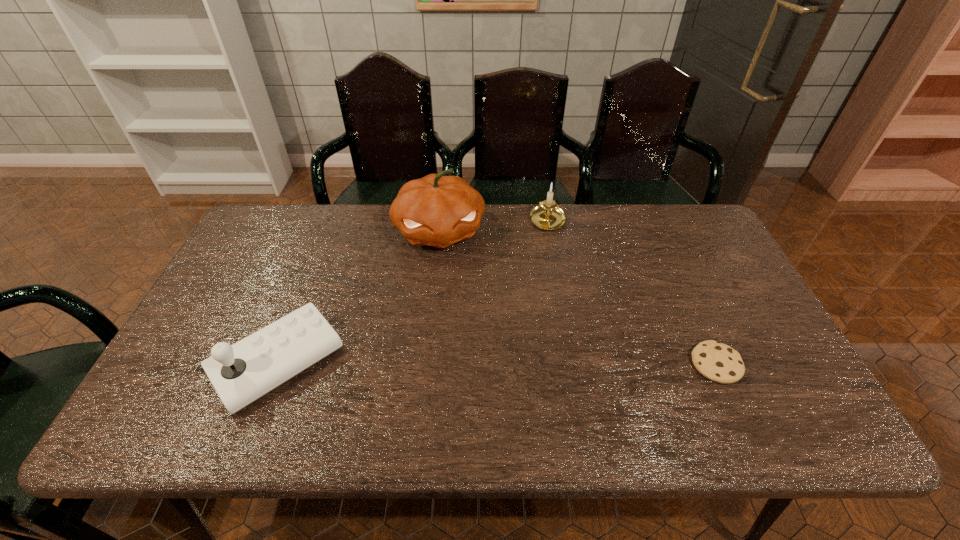
I want to click on free space on the desktop that is between the leftmost object and the shortest object and is positioned on the front face of the pumpkin, so click(x=467, y=363).

I want to click on vacant space on the desktop that is between the joystick and the cookie and is positioned on the handle side of the candle holder, so click(553, 363).